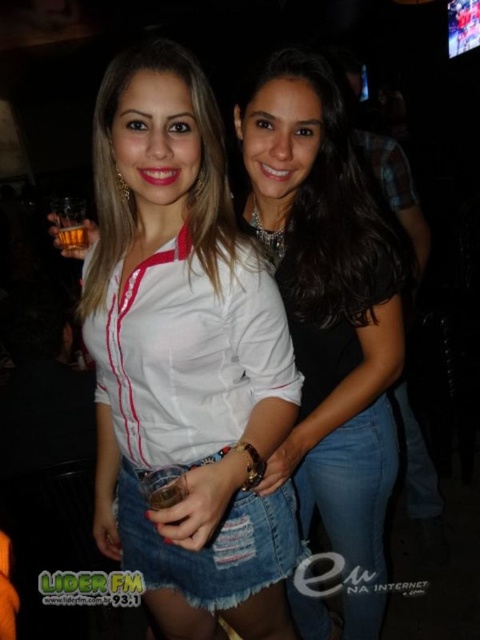
Does white matte shirt at center come in front of translucent amber glass at center?

Yes, it is in front of translucent amber glass at center.

Is white matte shirt at center taller than translucent amber glass at center?

Indeed, white matte shirt at center has a greater height compared to translucent amber glass at center.

I want to click on white matte shirt at center, so click(x=183, y=353).

What do you see at coordinates (328, 310) in the screenshot?
I see `denim jeans at center` at bounding box center [328, 310].

Which is more to the left, denim jeans at center or translucent amber glass at center?

From the viewer's perspective, translucent amber glass at center appears more on the left side.

Locate an element on the screen. denim jeans at center is located at coordinates (328, 310).

Does white matte shirt at center have a lesser height compared to denim jeans at center?

Correct, white matte shirt at center is not as tall as denim jeans at center.

Is point (153, 557) behind point (307, 200)?

Yes, it is.

Find the location of a particular element. white matte shirt at center is located at coordinates (183, 353).